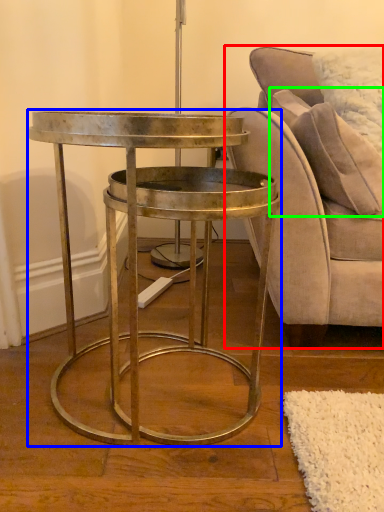
Question: Which is nearer to the chair (highlighted by a red box)? table (highlighted by a blue box) or pillow (highlighted by a green box).

Choices:
 (A) table
 (B) pillow

Answer: (B)